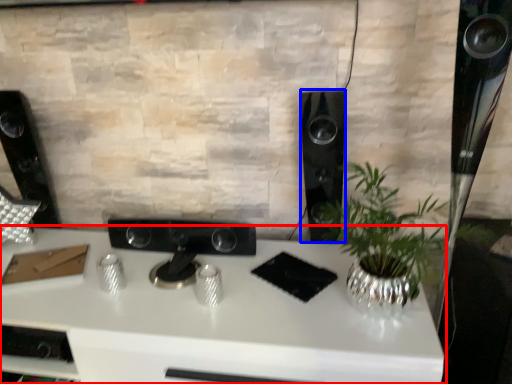
Question: Which object is further to the camera taking this photo, desk (highlighted by a red box) or speaker (highlighted by a blue box)?

Choices:
 (A) desk
 (B) speaker

Answer: (B)